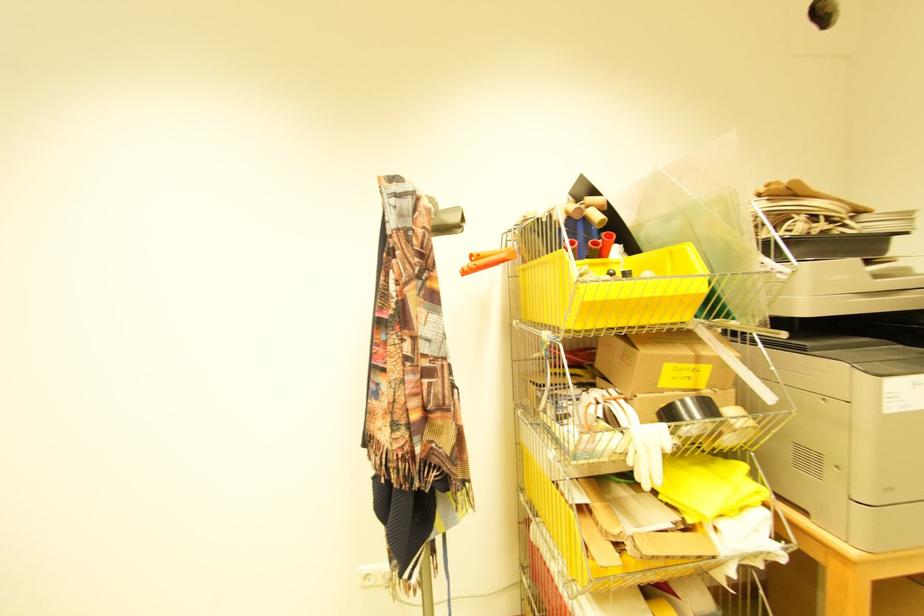
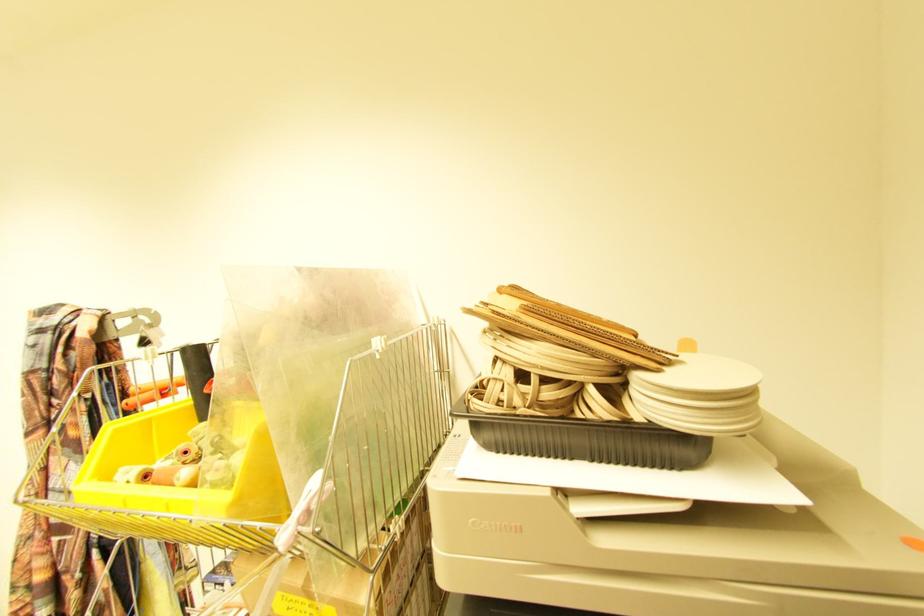
The images are taken continuously from a first-person perspective. In which direction are you moving?

The movement direction of the cameraman is right, forward.